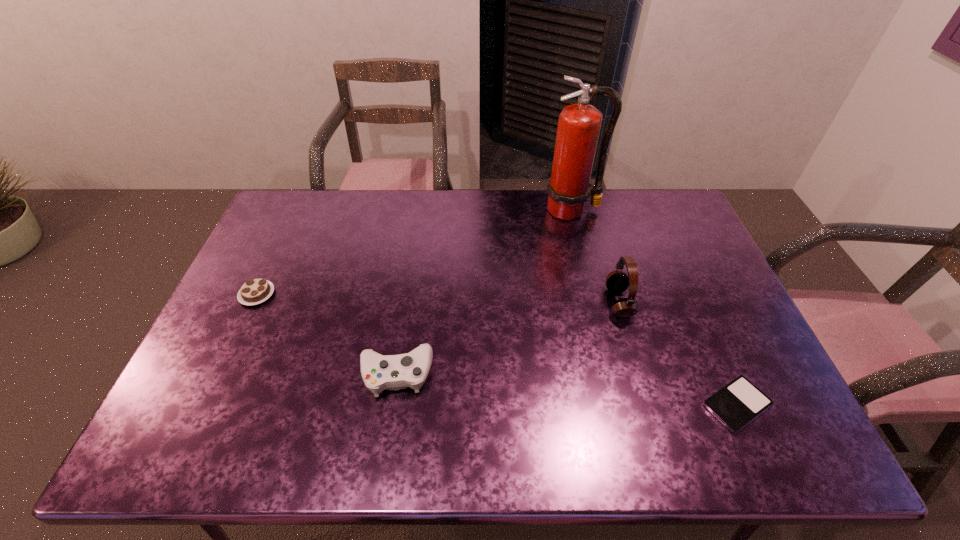
At what (x,y) coordinates should I click in order to perform the action: click on free location located 0.170m on the ear pads of the headset. Please return your answer as a coordinate pair (x, y). Looking at the image, I should click on (548, 302).

I want to click on vacant area situated on the ear pads of the headset, so click(x=575, y=302).

What are the coordinates of `vacant space located on the ear pads of the headset` in the screenshot? It's located at (541, 302).

Locate an element on the screen. free location located on the right of the control is located at coordinates (452, 373).

This screenshot has height=540, width=960. I want to click on vacant region located on the front of the chocolate cake, so click(x=204, y=407).

Identify the location of vacant region located on the left of the shortest object. This screenshot has width=960, height=540. (552, 404).

This screenshot has width=960, height=540. I want to click on object at the far edge, so (579, 125).

Where is `object at the near edge`? This screenshot has width=960, height=540. object at the near edge is located at coordinates (739, 402).

You are a GUI agent. You are given a task and a screenshot of the screen. Output one action in this format:
    pyautogui.click(x=<x>, y=<y>)
    Task: Click on the object that is positioned at the left edge
    The height and width of the screenshot is (540, 960).
    Given the screenshot: What is the action you would take?
    pyautogui.click(x=254, y=291)

In order to click on object that is positioned at the right edge in this screenshot , I will do `click(739, 402)`.